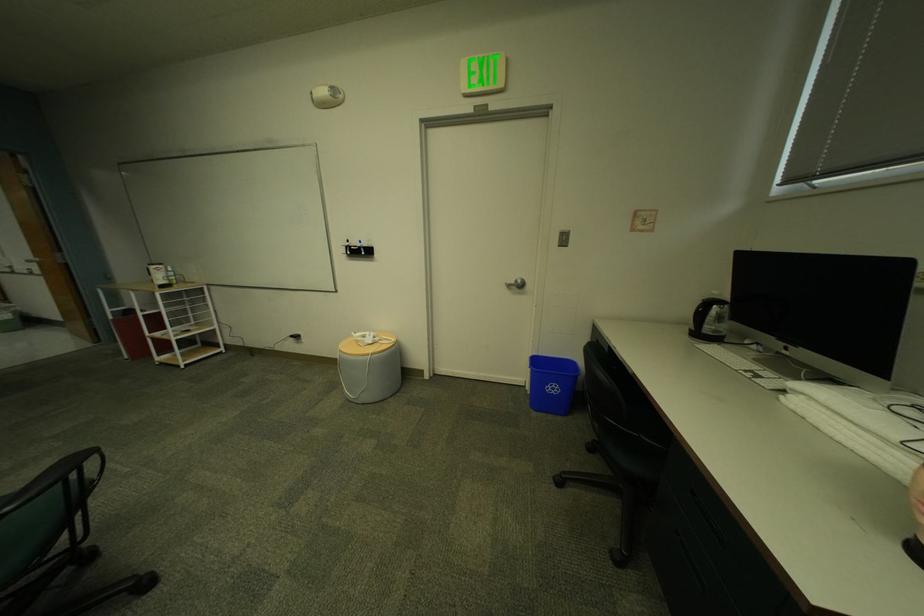
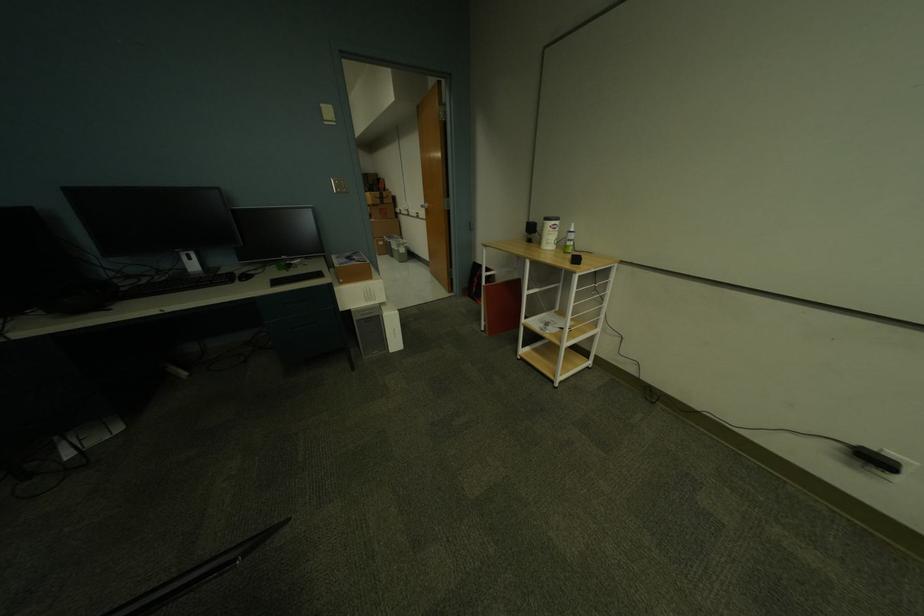
Locate, in the second image, the point that corresponds to point 41,275 in the first image.

(427, 217)